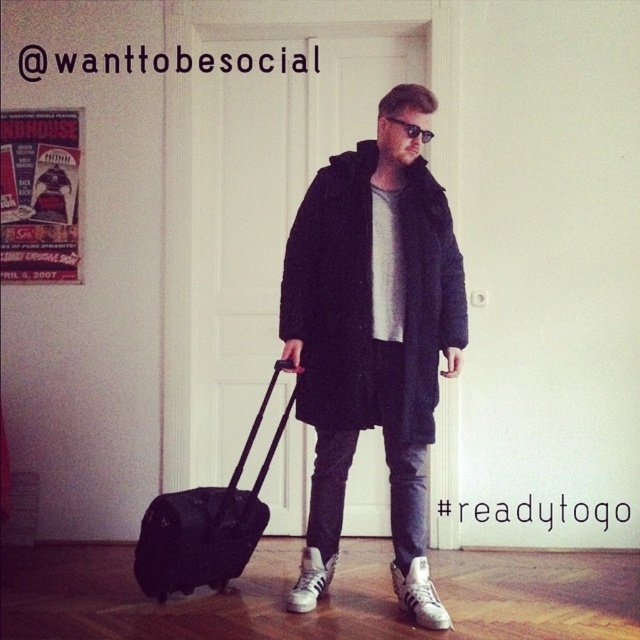
Is point (307, 200) positioned behind point (417, 131)?

That is True.

Does black woolen coat at center appear on the right side of black plastic sunglasses at center?

Incorrect, black woolen coat at center is not on the right side of black plastic sunglasses at center.

Who is more distant from viewer, (x=428, y=208) or (x=424, y=131)?

Point (x=428, y=208)

Identify the location of black woolen coat at center. pyautogui.click(x=372, y=337).

Is point (157, 584) farther from viewer compared to point (419, 131)?

Yes.

Measure the distance from black fabric suitcase at lower left to black plastic sunglasses at center.

black fabric suitcase at lower left and black plastic sunglasses at center are 4.51 feet apart.

Who is more distant from viewer, (x=188, y=550) or (x=422, y=131)?

Positioned behind is point (x=188, y=550).

Image resolution: width=640 pixels, height=640 pixels. I want to click on black fabric suitcase at lower left, so click(205, 524).

Is black woolen coat at center thinner than black fabric suitcase at lower left?

Incorrect, black woolen coat at center's width is not less than black fabric suitcase at lower left's.

Who is more distant from viewer, (301, 198) or (275, 372)?

Positioned behind is point (301, 198).

Where is `black woolen coat at center`? black woolen coat at center is located at coordinates (372, 337).

Find the location of a particular element. This screenshot has width=640, height=640. black woolen coat at center is located at coordinates (372, 337).